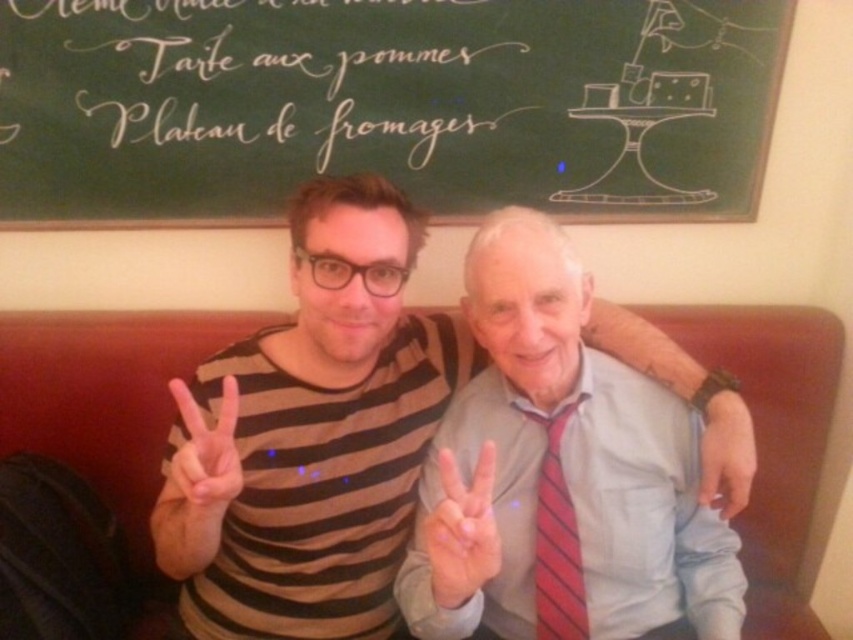
Question: Can you confirm if light blue shirt at center is thinner than red striped tie at center?

Choices:
 (A) yes
 (B) no

Answer: (B)

Question: Which of the following is the closest to the observer?

Choices:
 (A) pink flesh-toned hand at center
 (B) light blue shirt at center

Answer: (B)

Question: Is pink flesh-toned hand at center in front of smooth skin hand at center?

Choices:
 (A) no
 (B) yes

Answer: (B)

Question: Based on their relative distances, which object is farther from the red striped tie at center?

Choices:
 (A) green chalkboard at upper center
 (B) white matte hand at center
 (C) pink flesh-toned hand at center
 (D) light blue shirt at center

Answer: (A)

Question: Which object appears farthest from the camera in this image?

Choices:
 (A) red striped tie at center
 (B) smooth skin hand at center
 (C) green chalkboard at upper center
 (D) white matte hand at center

Answer: (C)

Question: Is white matte hand at center smaller than pink flesh-toned hand at center?

Choices:
 (A) no
 (B) yes

Answer: (B)